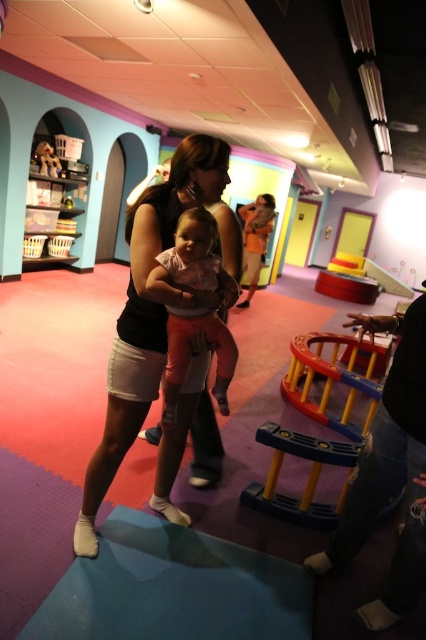
Who is taller, matte black tank top at center or wooden bear at upper left?

Standing taller between the two is matte black tank top at center.

Does matte black tank top at center have a lesser width compared to wooden bear at upper left?

No.

Does point (189, 388) come closer to viewer compared to point (40, 157)?

Yes, it is.

I want to click on matte black tank top at center, so click(x=149, y=314).

Who is more forward, (250, 221) or (51, 173)?

Positioned in front is point (51, 173).

Can you confirm if matte black shirt at center is thinner than wooden bear at upper left?

No, matte black shirt at center is not thinner than wooden bear at upper left.

Which is in front, point (241, 214) or point (46, 170)?

Positioned in front is point (46, 170).

What are the coordinates of `matte black shirt at center` in the screenshot? It's located at (255, 240).

Is matte pink fabric baby at center thinner than matte black shirt at center?

Correct, matte pink fabric baby at center's width is less than matte black shirt at center's.

Image resolution: width=426 pixels, height=640 pixels. What are the coordinates of `matte pink fabric baby at center` in the screenshot? It's located at (189, 356).